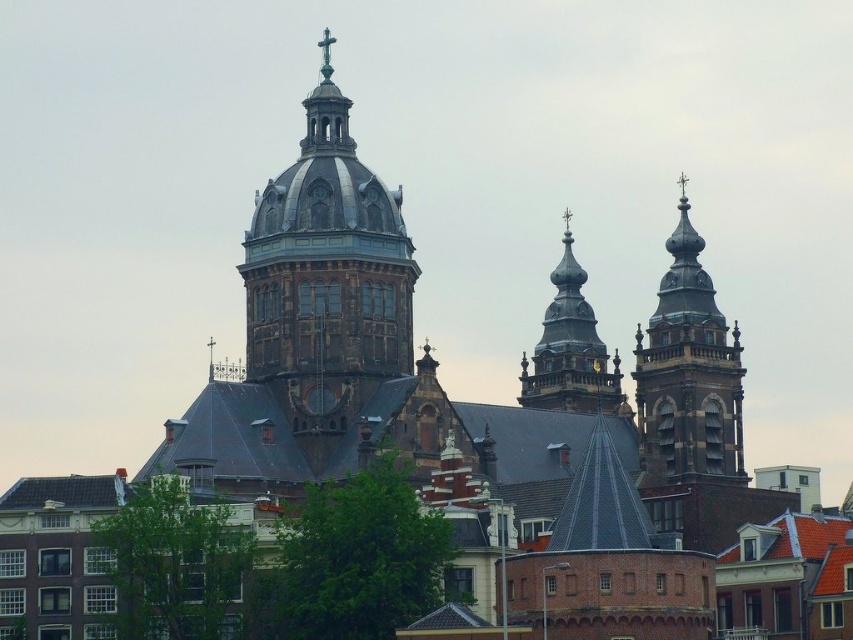
Question: Is dark brown stone tower at center closer to camera compared to polished stone spire at center?

Choices:
 (A) no
 (B) yes

Answer: (B)

Question: Is polished stone spire at upper right above polished stone spire at center?

Choices:
 (A) no
 (B) yes

Answer: (A)

Question: Estimate the real-world distances between objects in this image. Which object is closer to the polished stone spire at upper right?

Choices:
 (A) polished stone spire at center
 (B) dark brown stone tower at center

Answer: (A)

Question: Which point is farther to the camera?

Choices:
 (A) polished stone spire at center
 (B) polished stone spire at upper right

Answer: (A)

Question: Which of the following is the closest to the observer?

Choices:
 (A) polished stone spire at center
 (B) polished stone spire at upper right

Answer: (B)

Question: Is polished stone spire at upper right closer to camera compared to polished stone spire at center?

Choices:
 (A) yes
 (B) no

Answer: (A)